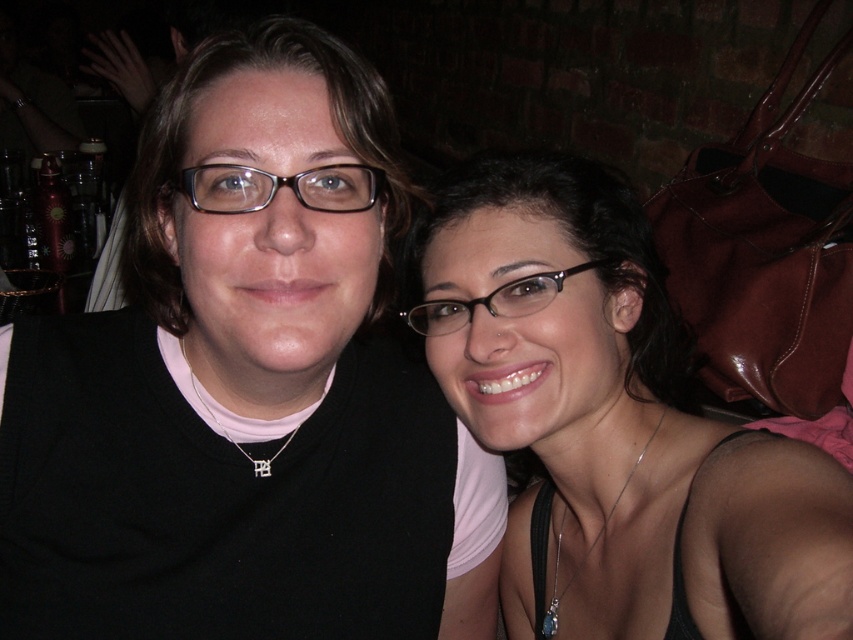
Question: Which point appears closest to the camera in this image?

Choices:
 (A) (457, 320)
 (B) (566, 512)
 (C) (358, 196)
 (D) (123, 355)

Answer: (C)

Question: Which of these objects is positioned closest to the silver/textured necklace at center?

Choices:
 (A) matte black sweater at center
 (B) matte black tank top at center
 (C) black plastic glasses at upper center
 (D) black plastic glasses at center

Answer: (A)

Question: Is black plastic glasses at center to the right of silver/textured necklace at center from the viewer's perspective?

Choices:
 (A) no
 (B) yes

Answer: (B)

Question: Is matte black sweater at center to the left of black plastic glasses at center from the viewer's perspective?

Choices:
 (A) yes
 (B) no

Answer: (A)

Question: Does matte black sweater at center have a greater width compared to silver/textured necklace at center?

Choices:
 (A) no
 (B) yes

Answer: (B)

Question: Which object is closer to the camera taking this photo?

Choices:
 (A) black plastic glasses at upper center
 (B) matte black tank top at center

Answer: (B)